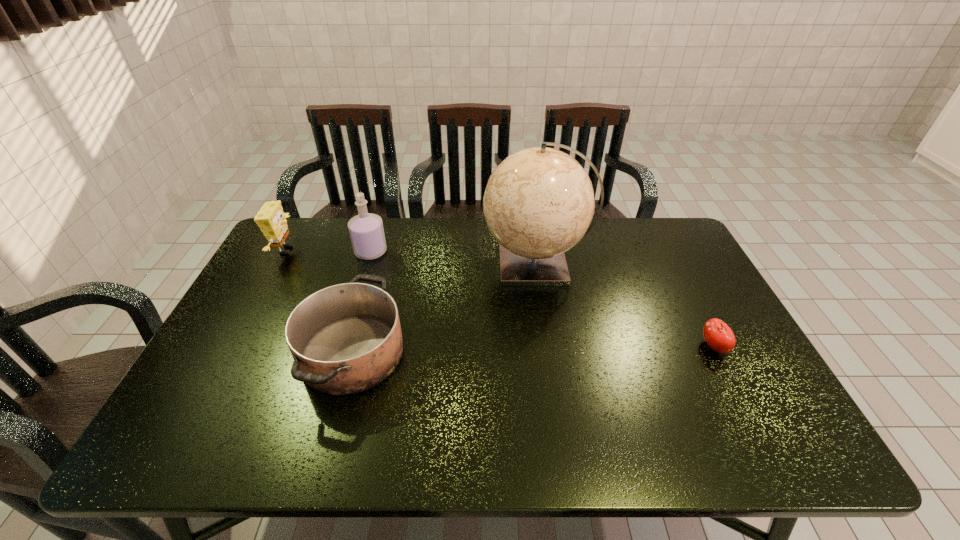
Locate an element on the screen. The image size is (960, 540). vacant space situated 0.310m on the surface of the globe showing Europe and Africa is located at coordinates (385, 264).

The height and width of the screenshot is (540, 960). Identify the location of free location located on the right of the fourth shortest object. (491, 252).

Identify the location of free space located on the face of the third tallest object. (412, 250).

Identify the location of vacant space located on the left of the saucepan. The height and width of the screenshot is (540, 960). (266, 353).

At what (x,y) coordinates should I click in order to perform the action: click on free location located on the back of the rightmost object. Please return your answer as a coordinate pair (x, y). Image resolution: width=960 pixels, height=540 pixels. Looking at the image, I should click on (691, 303).

You are a GUI agent. You are given a task and a screenshot of the screen. Output one action in this format:
    pyautogui.click(x=<x>, y=<y>)
    Task: Click on the globe at the far edge
    Image resolution: width=960 pixels, height=540 pixels.
    Given the screenshot: What is the action you would take?
    pyautogui.click(x=538, y=203)

You are a GUI agent. You are given a task and a screenshot of the screen. Output one action in this format:
    pyautogui.click(x=<x>, y=<y>)
    Task: Click on the perfume present at the far edge
    The width and height of the screenshot is (960, 540).
    Given the screenshot: What is the action you would take?
    pyautogui.click(x=366, y=230)

Locate an element on the screen. Image resolution: width=960 pixels, height=540 pixels. sponge that is at the far edge is located at coordinates (271, 219).

What are the coordinates of `object that is at the left edge` in the screenshot? It's located at (271, 219).

I want to click on object at the right edge, so click(717, 334).